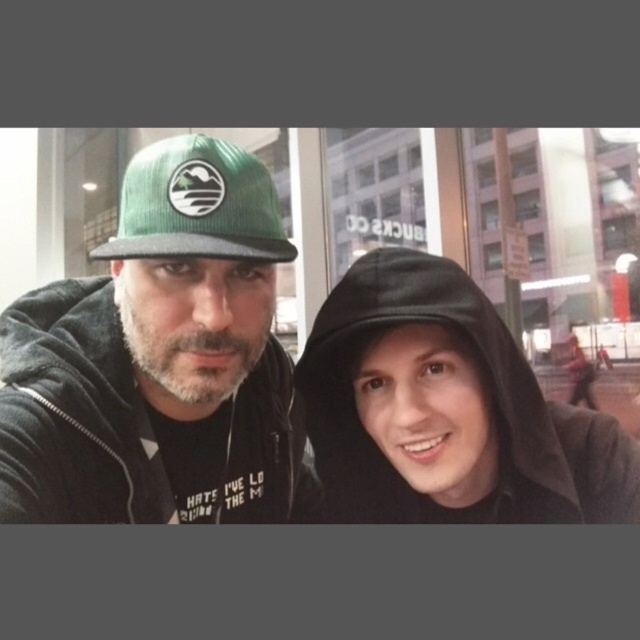
Is green corduroy cap at upper left above green corduroy baseball cap at upper left?

No, green corduroy cap at upper left is not above green corduroy baseball cap at upper left.

At what (x,y) coordinates should I click in order to perform the action: click on green corduroy cap at upper left. Please return your answer as a coordinate pair (x, y). This screenshot has width=640, height=640. Looking at the image, I should click on (161, 360).

Can you confirm if black matte hoodie at right is smaller than green corduroy baseball cap at upper left?

Incorrect, black matte hoodie at right is not smaller in size than green corduroy baseball cap at upper left.

Is black matte hoodie at right to the left of green corduroy baseball cap at upper left from the viewer's perspective?

In fact, black matte hoodie at right is to the right of green corduroy baseball cap at upper left.

What do you see at coordinates (445, 410) in the screenshot? I see `black matte hoodie at right` at bounding box center [445, 410].

Find the location of a particular element. The width and height of the screenshot is (640, 640). black matte hoodie at right is located at coordinates (445, 410).

In the scene shown: Does green corduroy cap at upper left appear under black matte hoodie at right?

No.

Find the location of a particular element. The width and height of the screenshot is (640, 640). green corduroy cap at upper left is located at coordinates (161, 360).

Where is `green corduroy cap at upper left`? The width and height of the screenshot is (640, 640). green corduroy cap at upper left is located at coordinates (161, 360).